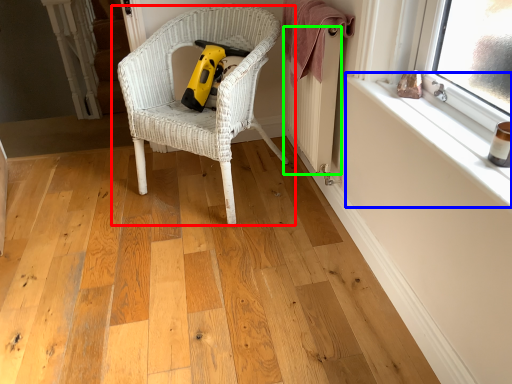
Question: Estimate the real-world distances between objects in this image. Which object is closer to chair (highlighted by a red box), window sill (highlighted by a blue box) or radiator (highlighted by a green box)?

Choices:
 (A) window sill
 (B) radiator

Answer: (B)